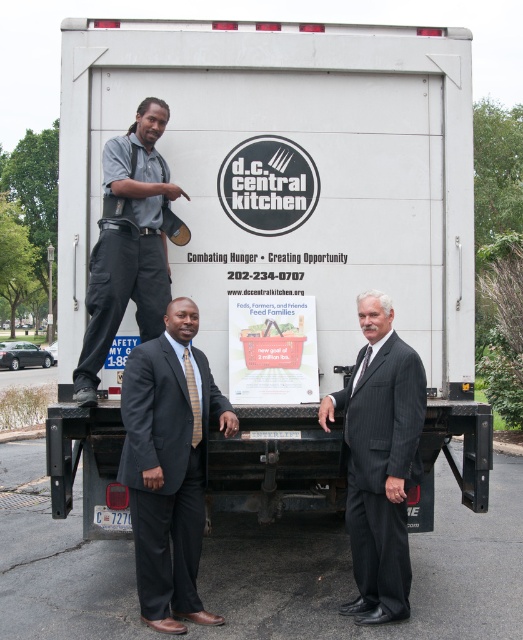
What are the coordinates of the white matte trailer truck at center?

The white matte trailer truck at center is located at coordinates point (x=294, y=221).

You are at an event where two people are wearing suits in front of a delivery truck. The scene includes a dark gray suit at center and a pinstripe suit at center. From your perspective, which suit is positioned to the left?

The dark gray suit at center is to the left of the pinstripe suit at center.